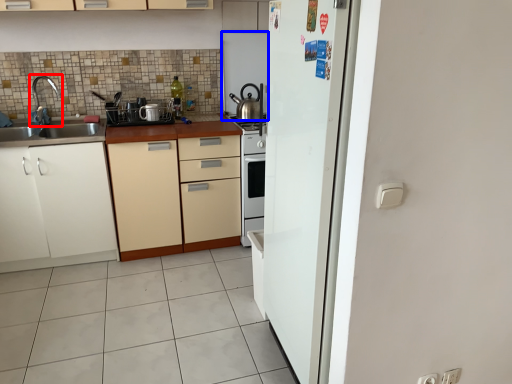
Question: Which point is closer to the camera, tap (highlighted by a red box) or appliance (highlighted by a blue box)?

Choices:
 (A) tap
 (B) appliance

Answer: (A)